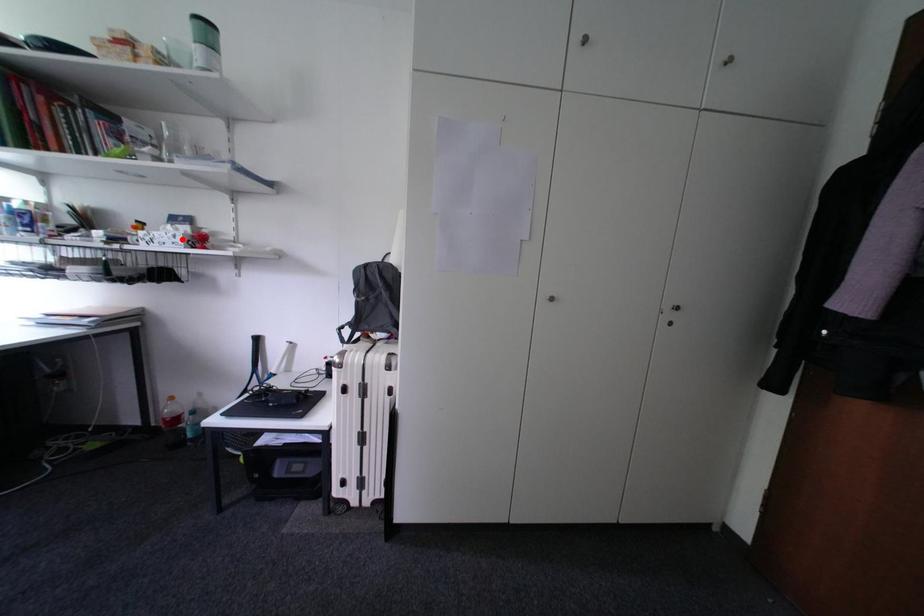
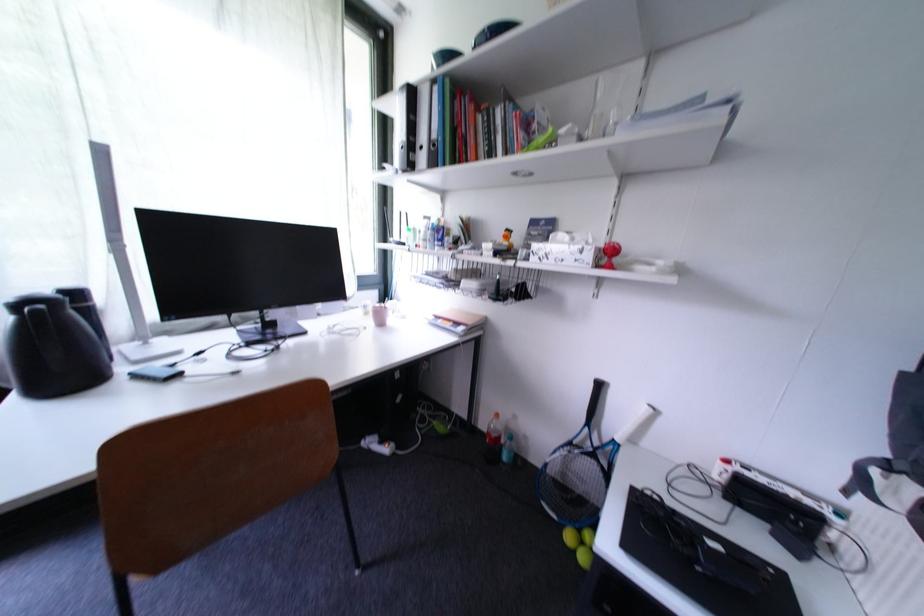
Where in the second image is the point corresponding to the highlighted location from the first image?

(590, 253)